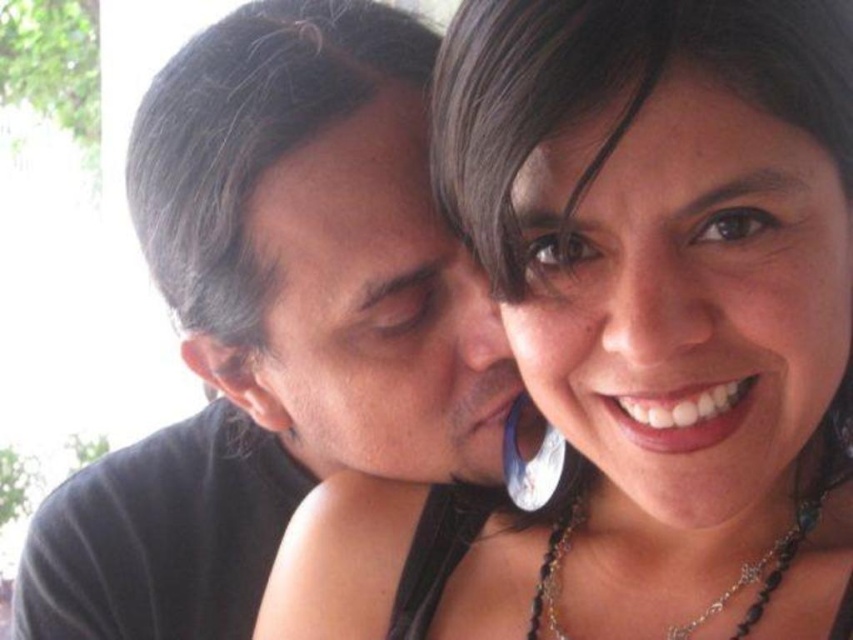
Question: Which point is farther to the camera?

Choices:
 (A) matte black shirt at center
 (B) matte black hair at center

Answer: (A)

Question: Where is matte black hair at center located in relation to black beaded necklace at lower right in the image?

Choices:
 (A) left
 (B) right

Answer: (A)

Question: Considering the relative positions of matte black hair at center and matte black shirt at center in the image provided, where is matte black hair at center located with respect to matte black shirt at center?

Choices:
 (A) left
 (B) right

Answer: (B)

Question: Which object is positioned closest to the matte black shirt at center?

Choices:
 (A) black beaded necklace at lower right
 (B) matte black hair at center

Answer: (B)

Question: Which point is farther to the camera?

Choices:
 (A) (538, 214)
 (B) (229, 600)
 (C) (761, 598)

Answer: (B)

Question: Can you confirm if matte black hair at center is bigger than matte black shirt at center?

Choices:
 (A) yes
 (B) no

Answer: (B)